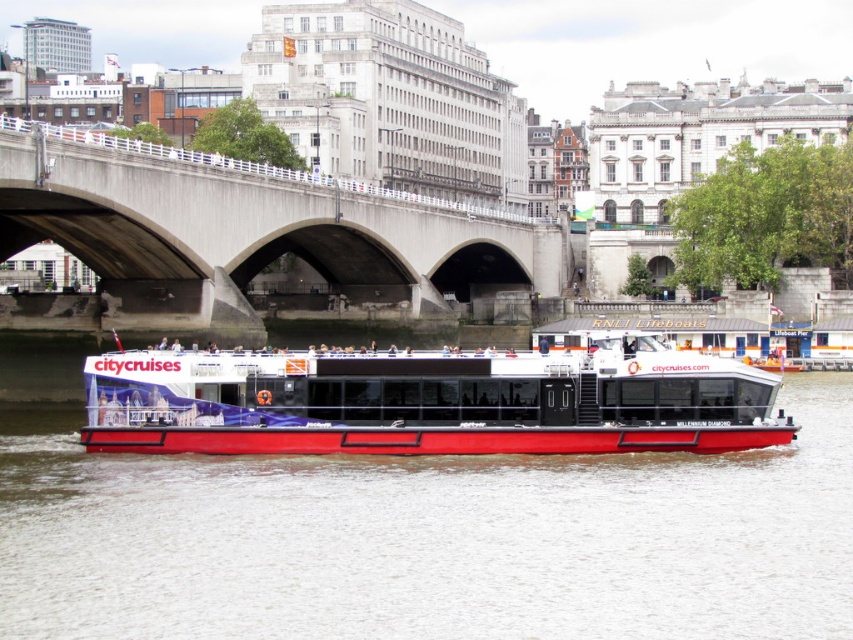
Question: Observing the image, what is the correct spatial positioning of red matte water at center in reference to red matte boat at center?

Choices:
 (A) right
 (B) left

Answer: (B)

Question: Which point is farther to the camera?

Choices:
 (A) red matte boat at center
 (B) red matte water at center

Answer: (A)

Question: Which object is positioned farthest from the red matte boat at center?

Choices:
 (A) concrete bridge at center
 (B) red matte water at center

Answer: (A)

Question: Which of the following is the closest to the observer?

Choices:
 (A) red matte water at center
 (B) concrete bridge at center
 (C) red matte boat at center

Answer: (A)

Question: Can you confirm if concrete bridge at center is wider than red matte boat at center?

Choices:
 (A) yes
 (B) no

Answer: (A)

Question: Observing the image, what is the correct spatial positioning of concrete bridge at center in reference to red matte boat at center?

Choices:
 (A) left
 (B) right

Answer: (A)